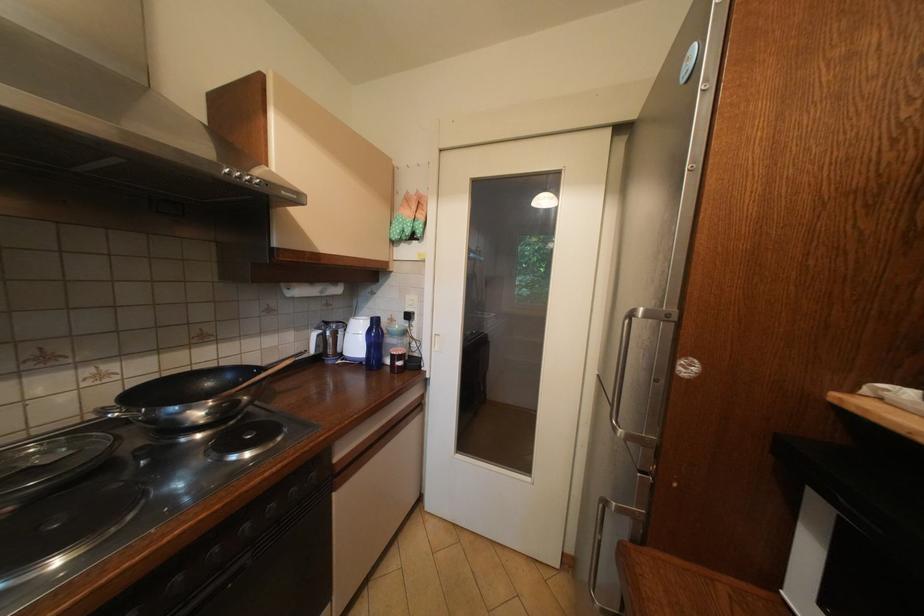
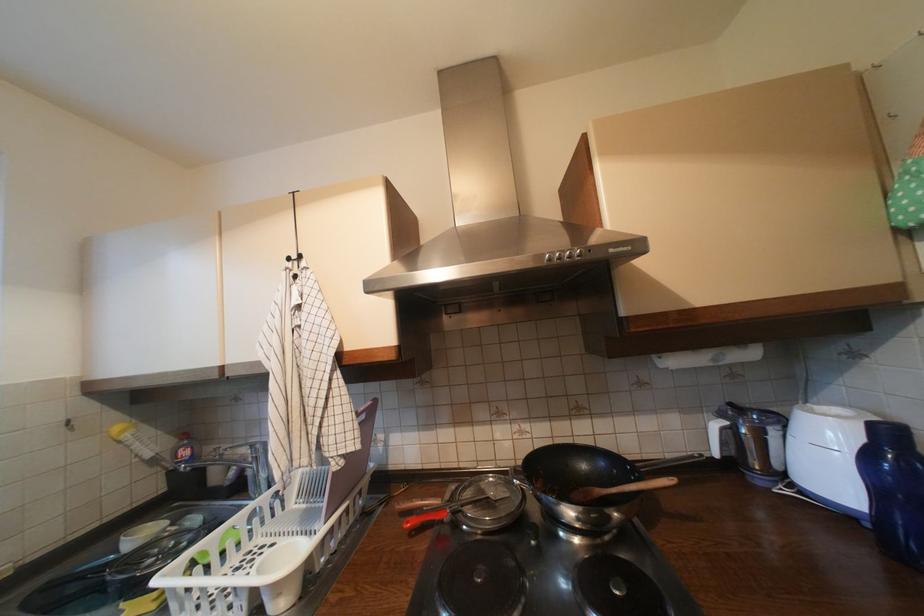
In the second image, find the point that corresponds to the point at 252,386 in the first image.

(623, 492)